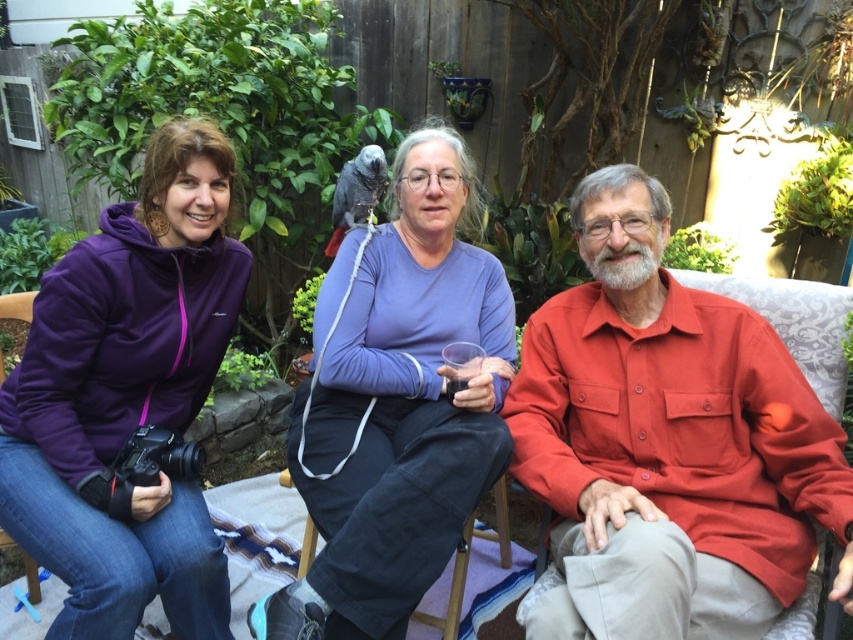
Question: Is matte orange shirt at right to the right of purple cotton shirt at center from the viewer's perspective?

Choices:
 (A) no
 (B) yes

Answer: (B)

Question: Among these objects, which one is nearest to the camera?

Choices:
 (A) matte orange shirt at right
 (B) purple cotton shirt at center
 (C) gray matte parrot at center

Answer: (A)

Question: Which is farther from the purple cotton shirt at center?

Choices:
 (A) purple fleece jacket at left
 (B) matte orange shirt at right

Answer: (A)

Question: Is purple cotton shirt at center further to camera compared to denim at left?

Choices:
 (A) yes
 (B) no

Answer: (B)

Question: Among these points, which one is farthest from the camera?

Choices:
 (A) (677, 570)
 (B) (142, 182)
 (C) (0, 305)
 (D) (346, 205)

Answer: (D)

Question: Does matte orange shirt at right appear under denim at left?

Choices:
 (A) no
 (B) yes

Answer: (A)